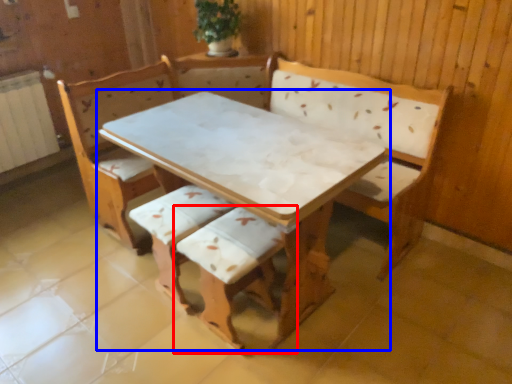
Question: Which of the following is the farthest to the observer, armchair (highlighted by a red box) or table (highlighted by a blue box)?

Choices:
 (A) armchair
 (B) table

Answer: (A)